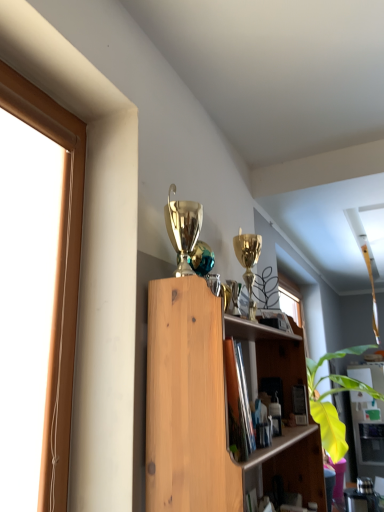
Describe the element at coordinates (214, 405) in the screenshot. The height and width of the screenshot is (512, 384). I see `wooden shelf at center` at that location.

The image size is (384, 512). Find the location of `wooden shelf at center`. wooden shelf at center is located at coordinates [214, 405].

Locate an element on the screen. matte wood cabinet at center is located at coordinates (368, 433).

What do you see at coordinates (368, 433) in the screenshot? I see `matte wood cabinet at center` at bounding box center [368, 433].

Find the location of a particular element. wooden shelf at center is located at coordinates click(x=214, y=405).

Which is more to the left, wooden shelf at center or matte wood cabinet at center?

wooden shelf at center is more to the left.

Which is behind, wooden shelf at center or matte wood cabinet at center?

Positioned behind is matte wood cabinet at center.

Considering the points (180, 305) and (370, 386), which point is behind, point (180, 305) or point (370, 386)?

Positioned behind is point (370, 386).

From the image's perspective, which is below, wooden shelf at center or matte wood cabinet at center?

matte wood cabinet at center is shown below in the image.

From a real-world perspective, is wooden shelf at center physically located above or below matte wood cabinet at center?

In terms of real-world spatial position, wooden shelf at center is above matte wood cabinet at center.

Does wooden shelf at center have a greater width compared to matte wood cabinet at center?

Incorrect, the width of wooden shelf at center does not surpass that of matte wood cabinet at center.

Does wooden shelf at center have a greater height compared to matte wood cabinet at center?

No.

In terms of size, does wooden shelf at center appear bigger or smaller than matte wood cabinet at center?

Considering their sizes, wooden shelf at center takes up less space than matte wood cabinet at center.

Choose the correct answer: Is wooden shelf at center inside matte wood cabinet at center or outside it?

wooden shelf at center is spatially situated outside matte wood cabinet at center.

Is wooden shelf at center touching matte wood cabinet at center?

No, wooden shelf at center is not in contact with matte wood cabinet at center.

Is wooden shelf at center aimed at matte wood cabinet at center?

No, wooden shelf at center is not facing towards matte wood cabinet at center.

What's the angular difference between wooden shelf at center and matte wood cabinet at center's facing directions?

The facing directions of wooden shelf at center and matte wood cabinet at center are 89.8 degrees apart.

Locate an element on the screen. cabinet beneath the wooden shelf at center (from a real-world perspective) is located at coordinates (368, 433).

From the picture: Considering the positions of objects matte wood cabinet at center and wooden shelf at center in the image provided, who is more to the left, matte wood cabinet at center or wooden shelf at center?

Positioned to the left is wooden shelf at center.

Who is more distant, matte wood cabinet at center or wooden shelf at center?

matte wood cabinet at center is more distant.

Which is more distant, (364,426) or (275,464)?

The point (364,426) is farther.

From the image's perspective, is matte wood cabinet at center located beneath wooden shelf at center?

Indeed, from the image's perspective, matte wood cabinet at center is shown beneath wooden shelf at center.

From a real-world perspective, which is physically above, matte wood cabinet at center or wooden shelf at center?

From a 3D spatial view, wooden shelf at center is above.

Can you confirm if matte wood cabinet at center is wider than wooden shelf at center?

Yes, matte wood cabinet at center is wider than wooden shelf at center.

In the scene shown: Is matte wood cabinet at center taller or shorter than wooden shelf at center?

In the image, matte wood cabinet at center appears to be taller than wooden shelf at center.

Who is smaller, matte wood cabinet at center or wooden shelf at center?

wooden shelf at center.

Is wooden shelf at center located within matte wood cabinet at center?

No, wooden shelf at center is not inside matte wood cabinet at center.

Is matte wood cabinet at center next to wooden shelf at center?

No.

Does matte wood cabinet at center turn towards wooden shelf at center?

Yes, matte wood cabinet at center is turned towards wooden shelf at center.

Consider the image. How different are the orientations of matte wood cabinet at center and wooden shelf at center in degrees?

89.8 degrees separate the facing orientations of matte wood cabinet at center and wooden shelf at center.

The width and height of the screenshot is (384, 512). Find the location of `shelf on the left of matte wood cabinet at center`. shelf on the left of matte wood cabinet at center is located at coordinates (214, 405).

You are a GUI agent. You are given a task and a screenshot of the screen. Output one action in this format:
    pyautogui.click(x=<x>, y=<y>)
    Task: Click on the shelf above the matte wood cabinet at center (from the image's perspective)
    
    Given the screenshot: What is the action you would take?
    pyautogui.click(x=214, y=405)

What are the coordinates of `shelf in front of the matte wood cabinet at center` in the screenshot? It's located at 214,405.